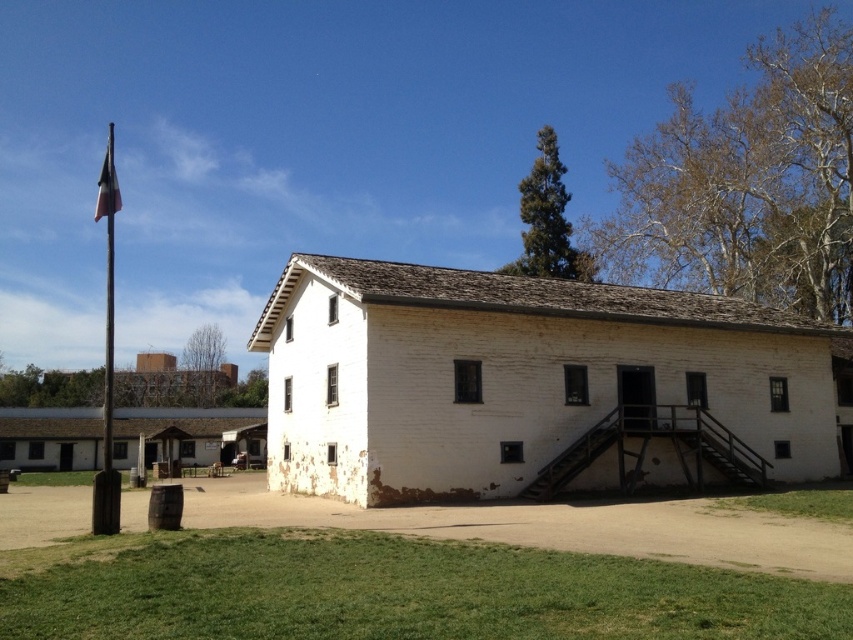
Question: Is wooden flag pole at left bigger than blue fabric flag at upper left?

Choices:
 (A) yes
 (B) no

Answer: (A)

Question: Which object appears closest to the camera in this image?

Choices:
 (A) blue fabric flag at upper left
 (B) wooden flag pole at left

Answer: (B)

Question: Can you confirm if wooden flag pole at left is positioned to the left of blue fabric flag at upper left?

Choices:
 (A) yes
 (B) no

Answer: (A)

Question: Does wooden flag pole at left have a lesser width compared to blue fabric flag at upper left?

Choices:
 (A) yes
 (B) no

Answer: (A)

Question: Which point is farther from the camera taking this photo?

Choices:
 (A) (106, 195)
 (B) (97, 529)

Answer: (A)